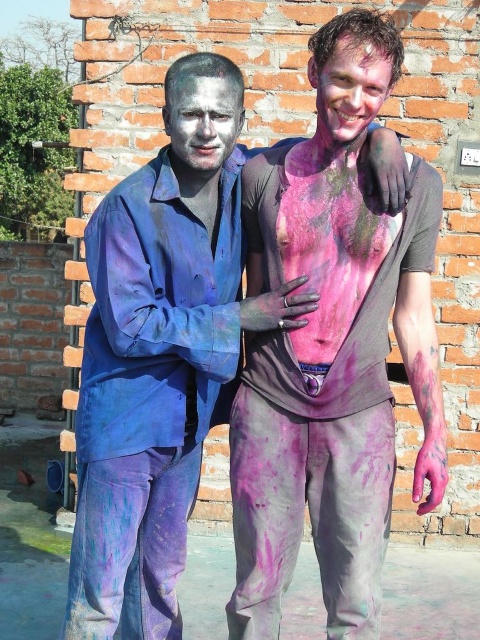
Based on the photo, you are a photographer trying to capture a closeup of the white matte face at center without including the purple matte pants at lower left in the frame. Is this possible given their relative sizes?

The purple matte pants at lower left are wider than the white matte face at center, so it might be possible to frame the shot to exclude the pants by focusing on the narrower face area.

You are a photographer trying to capture the scene of two friends celebrating Holi. You notice the purple matte pants at lower left and the matte pink paint at center. Which object is positioned to the right side of the other?

The purple matte pants at lower left is to the right of the matte pink paint at center, so the purple matte pants at lower left is positioned to the right of the matte pink paint at center.

You are a photographer trying to capture the scene of two people covered in colorful powders. You need to ensure that both the purple matte pants at lower left and the white matte face at center are clearly visible in your photo. Based on their sizes, which object should you focus on first to ensure proper exposure?

The purple matte pants at lower left has a greater height compared to the white matte face at center, so you should focus on the purple matte pants at lower left first to ensure proper exposure since it is larger and might require more attention for accurate lighting.